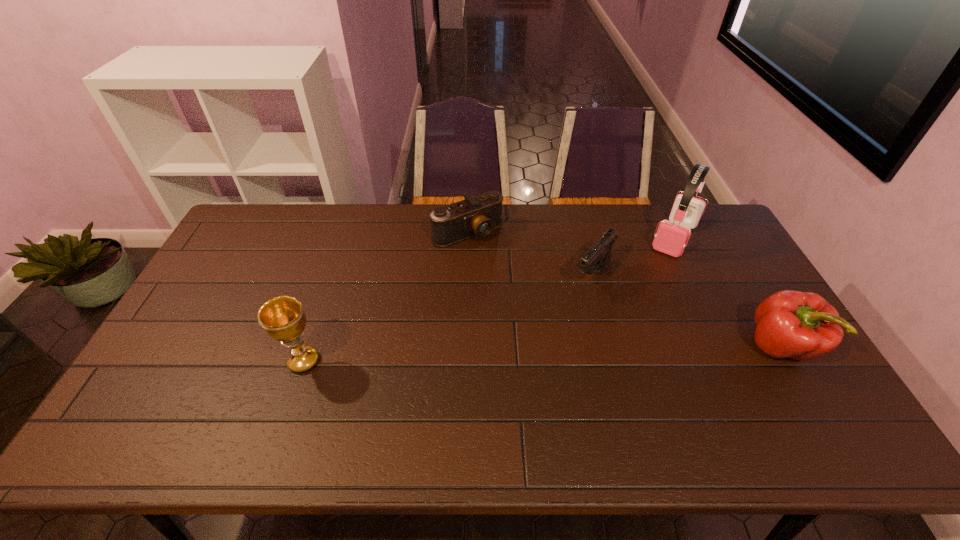
The height and width of the screenshot is (540, 960). Identify the location of vacant spot on the desktop that is between the leftmost object and the pepper and is positioned at the barrel of the pistol. (525, 354).

I want to click on vacant space on the desktop that is between the chalice and the pepper and is positioned on the outer surface of the earphone, so click(x=609, y=352).

This screenshot has width=960, height=540. What are the coordinates of `vacant space on the desktop that is between the leftmost object and the pepper and is positioned on the lens of the shortest object` in the screenshot? It's located at (574, 353).